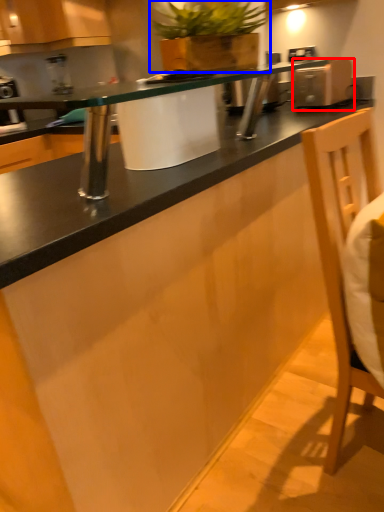
Question: Which object is closer to the camera taking this photo, appliance (highlighted by a red box) or houseplant (highlighted by a blue box)?

Choices:
 (A) appliance
 (B) houseplant

Answer: (B)